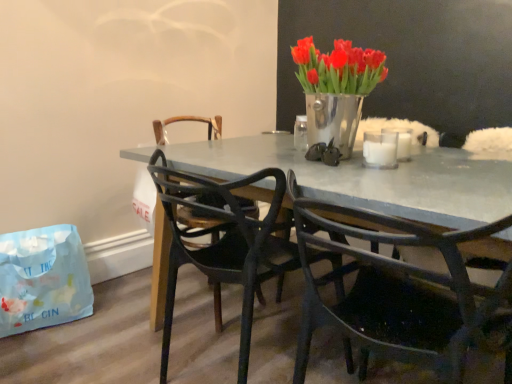
This screenshot has height=384, width=512. What do you see at coordinates (380, 149) in the screenshot? I see `white matte glass at upper center, the second candle in the back-to-front sequence` at bounding box center [380, 149].

Measure the distance between point (175, 283) and camera.

6.95 feet.

How much space does white frosted glass candle at upper right, positioned as the 2th candle in front-to-back order, occupy horizontally?

4.54 inches.

I want to click on white matte glass at upper center, placed as the 1th candle when sorted from front to back, so click(380, 149).

Does point (388, 132) appear closer or farther from the camera than point (288, 243)?

Clearly, point (388, 132) is more distant from the camera than point (288, 243).

Choose the correct answer: Is white matte glass at upper center, the second candle in the back-to-front sequence, inside black plastic chair at center, positioned as the first chair in left-to-right order, or outside it?

white matte glass at upper center, the second candle in the back-to-front sequence, is not enclosed by black plastic chair at center, positioned as the first chair in left-to-right order.

Based on the photo, is white matte glass at upper center, placed as the 1th candle when sorted from front to back, at the right side of black plastic chair at center, positioned as the second chair in right-to-left order?

Correct, you'll find white matte glass at upper center, placed as the 1th candle when sorted from front to back, to the right of black plastic chair at center, positioned as the second chair in right-to-left order.

From the image's perspective, which candle is the 1st one above the black plastic chair at center, positioned as the first chair in left-to-right order? Please provide its 2D coordinates.

[(380, 149)]

Would you say black plastic chair at center, positioned as the first chair in left-to-right order, is inside or outside matte gray table at center?

black plastic chair at center, positioned as the first chair in left-to-right order, lies within the bounds of matte gray table at center.

Considering the sizes of objects black plastic chair at center, positioned as the second chair in right-to-left order, and matte gray table at center in the image provided, who is taller, black plastic chair at center, positioned as the second chair in right-to-left order, or matte gray table at center?

With more height is black plastic chair at center, positioned as the second chair in right-to-left order.

Is black plastic chair at center, positioned as the second chair in right-to-left order, aimed at matte gray table at center?

Yes.

Looking at this image, from a real-world perspective, which object stands above the other?

matte gray table at center, from a real-world perspective.

Based on the photo, is matte gray table at center outside of light blue paper bag at lower left?

Absolutely, matte gray table at center is external to light blue paper bag at lower left.

Is matte gray table at center far from light blue paper bag at lower left?

matte gray table at center is actually quite close to light blue paper bag at lower left.

Can you tell me how much matte gray table at center and light blue paper bag at lower left differ in facing direction?

The angle between the facing direction of matte gray table at center and the facing direction of light blue paper bag at lower left is 89 degrees.

Looking at this image, could you tell me if matte gray table at center is turned towards white frosted glass candle at upper right, positioned as the 2th candle in front-to-back order?

No, matte gray table at center is not facing towards white frosted glass candle at upper right, positioned as the 2th candle in front-to-back order.

The image size is (512, 384). In order to click on desk located on the left of white frosted glass candle at upper right, positioned as the 2th candle in front-to-back order in this screenshot , I will do `click(369, 177)`.

Choose the correct answer: Is matte gray table at center inside white frosted glass candle at upper right, positioned as the 2th candle in front-to-back order, or outside it?

matte gray table at center is not enclosed by white frosted glass candle at upper right, positioned as the 2th candle in front-to-back order.

From the image's perspective, who appears lower, matte gray table at center or white frosted glass candle at upper right, positioned as the 2th candle in front-to-back order?

matte gray table at center, from the image's perspective.

Is metallic silver vase at upper center not near black plastic chair at center, positioned as the first chair in left-to-right order?

No, metallic silver vase at upper center is not far away from black plastic chair at center, positioned as the first chair in left-to-right order.

Based on the photo, can you confirm if metallic silver vase at upper center is positioned to the left of black plastic chair at center, positioned as the first chair in left-to-right order?

No.

Is matte black chair at center, acting as the first chair starting from the right, spatially inside black plastic chair at center, positioned as the first chair in left-to-right order, or outside of it?

matte black chair at center, acting as the first chair starting from the right, lies outside black plastic chair at center, positioned as the first chair in left-to-right order.

Is black plastic chair at center, positioned as the first chair in left-to-right order, at the back of matte black chair at center, the 2th chair positioned from the left?

No.

Locate an element on the screen. chair below the black plastic chair at center, positioned as the second chair in right-to-left order (from the image's perspective) is located at coordinates click(398, 291).

Which is closer to the camera, (x=300, y=350) or (x=3, y=262)?

Point (x=300, y=350).

Considering the positions of objects matte black chair at center, the 2th chair positioned from the left, and light blue paper bag at lower left in the image provided, who is in front, matte black chair at center, the 2th chair positioned from the left, or light blue paper bag at lower left?

matte black chair at center, the 2th chair positioned from the left.

Is matte black chair at center, the 2th chair positioned from the left, oriented away from light blue paper bag at lower left?

No, light blue paper bag at lower left is not at the back of matte black chair at center, the 2th chair positioned from the left.

This screenshot has width=512, height=384. I want to click on handbag on the left of the matte black chair at center, the 2th chair positioned from the left, so click(42, 279).

This screenshot has width=512, height=384. In order to click on the 2nd chair to the left when counting from the white matte glass at upper center, the second candle in the back-to-front sequence in this screenshot , I will do `click(223, 244)`.

There is a matte gray table at center. What are the coordinates of `the 2nd chair above it (from a real-world perspective)` in the screenshot? It's located at (223, 244).

From the image, which object appears to be farther from light blue paper bag at lower left, matte black chair at center, acting as the first chair starting from the right, or white frosted glass candle at upper right, placed as the 1th candle when sorted from back to front?

white frosted glass candle at upper right, placed as the 1th candle when sorted from back to front.

Looking at the image, which one is located further to matte black chair at center, the 2th chair positioned from the left, black plastic chair at center, positioned as the first chair in left-to-right order, or matte gray table at center?

Based on the image, black plastic chair at center, positioned as the first chair in left-to-right order, appears to be further to matte black chair at center, the 2th chair positioned from the left.

Estimate the real-world distances between objects in this image. Which object is closer to white matte glass at upper center, placed as the 1th candle when sorted from front to back, black plastic chair at center, positioned as the second chair in right-to-left order, or metallic silver vase at upper center?

Based on the image, metallic silver vase at upper center appears to be nearer to white matte glass at upper center, placed as the 1th candle when sorted from front to back.

Considering their positions, is matte gray table at center positioned closer to black plastic chair at center, positioned as the first chair in left-to-right order, than matte black chair at center, the 2th chair positioned from the left?

The object closer to black plastic chair at center, positioned as the first chair in left-to-right order, is matte gray table at center.

Which object lies nearer to the anchor point metallic silver vase at upper center, light blue paper bag at lower left or white frosted glass candle at upper right, placed as the 1th candle when sorted from back to front?

white frosted glass candle at upper right, placed as the 1th candle when sorted from back to front.

Considering their positions, is white frosted glass candle at upper right, positioned as the 2th candle in front-to-back order, positioned closer to metallic silver vase at upper center than light blue paper bag at lower left?

Based on the image, white frosted glass candle at upper right, positioned as the 2th candle in front-to-back order, appears to be nearer to metallic silver vase at upper center.

Which object lies nearer to the anchor point metallic silver vase at upper center, light blue paper bag at lower left or matte black chair at center, the 2th chair positioned from the left?

matte black chair at center, the 2th chair positioned from the left, is positioned closer to the anchor metallic silver vase at upper center.

From the image, which object appears to be farther from metallic silver vase at upper center, white matte glass at upper center, the second candle in the back-to-front sequence, or matte black chair at center, acting as the first chair starting from the right?

matte black chair at center, acting as the first chair starting from the right, lies further to metallic silver vase at upper center than the other object.

The width and height of the screenshot is (512, 384). Find the location of `chair between light blue paper bag at lower left and metallic silver vase at upper center`. chair between light blue paper bag at lower left and metallic silver vase at upper center is located at coordinates (223, 244).

I want to click on desk that lies between metallic silver vase at upper center and matte black chair at center, acting as the first chair starting from the right, from top to bottom, so click(x=369, y=177).

Locate an element on the screen. The image size is (512, 384). chair that lies between metallic silver vase at upper center and matte black chair at center, acting as the first chair starting from the right, from top to bottom is located at coordinates (223, 244).

Image resolution: width=512 pixels, height=384 pixels. Identify the location of houseplant located between light blue paper bag at lower left and matte gray table at center in the left-right direction. (336, 93).